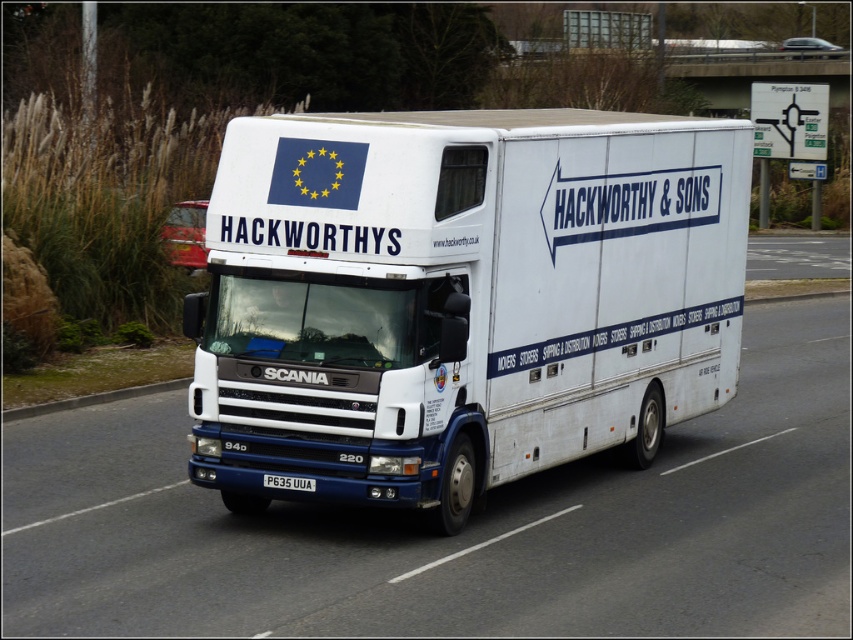
Can you confirm if white matte trailer truck at center is shorter than white plastic license plate at center?

Incorrect, white matte trailer truck at center's height does not fall short of white plastic license plate at center's.

Where is `white matte trailer truck at center`? The image size is (853, 640). white matte trailer truck at center is located at coordinates (460, 298).

Identify the location of white matte trailer truck at center. The image size is (853, 640). (460, 298).

Can you confirm if white matte trailer truck at center is shorter than white glossy truck at center?

Indeed, white matte trailer truck at center has a lesser height compared to white glossy truck at center.

Find the location of `white matte trailer truck at center`. white matte trailer truck at center is located at coordinates (460, 298).

I want to click on white matte trailer truck at center, so click(460, 298).

Is point (648, 592) positioned before point (305, 488)?

Yes.

Is white glossy truck at center below white plastic license plate at center?

Yes, white glossy truck at center is below white plastic license plate at center.

Is point (788, 625) farther from viewer compared to point (312, 490)?

No, it is not.

Locate an element on the screen. white glossy truck at center is located at coordinates (460, 532).